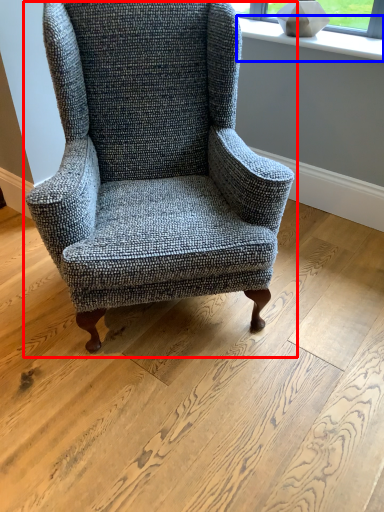
Question: Which point is closer to the camera, chair (highlighted by a red box) or window sill (highlighted by a blue box)?

Choices:
 (A) chair
 (B) window sill

Answer: (A)